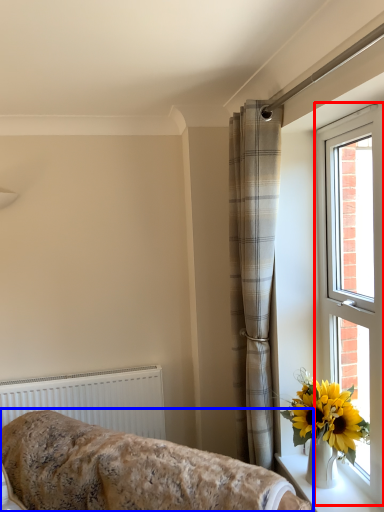
Question: Which object is closer to the camera taking this photo, window (highlighted by a red box) or furniture (highlighted by a blue box)?

Choices:
 (A) window
 (B) furniture

Answer: (B)